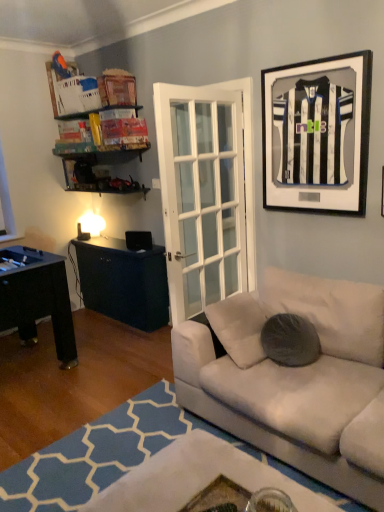
Question: Is point (289, 332) positioned closer to the camera than point (296, 196)?

Choices:
 (A) farther
 (B) closer

Answer: (B)

Question: Is gray fuzzy pillow at center situated inside black matte jersey at upper right or outside?

Choices:
 (A) outside
 (B) inside

Answer: (A)

Question: Estimate the real-world distances between objects in this image. Which object is farther from the white fabric couch at lower right?

Choices:
 (A) black matte jersey at upper right
 (B) gray fuzzy pillow at center

Answer: (A)

Question: Considering the real-world distances, which object is farthest from the black matte jersey at upper right?

Choices:
 (A) gray fuzzy pillow at center
 (B) white fabric couch at lower right

Answer: (A)